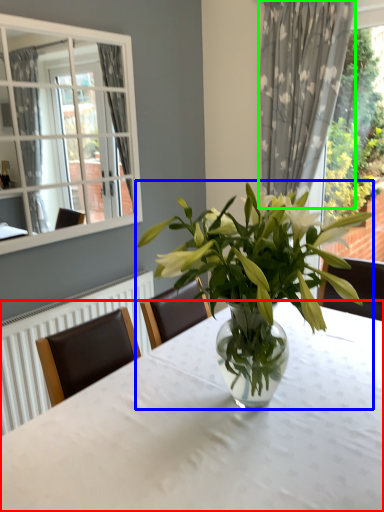
Question: Which is nearer to the table (highlighted by a red box)? houseplant (highlighted by a blue box) or curtain (highlighted by a green box).

Choices:
 (A) houseplant
 (B) curtain

Answer: (A)